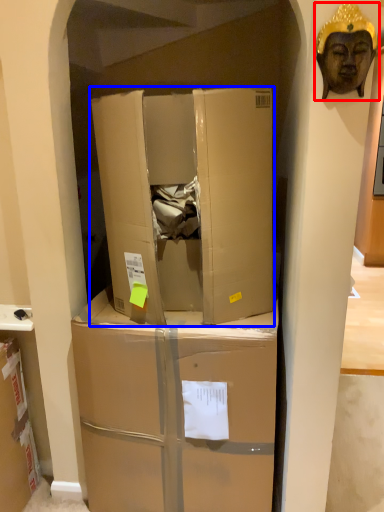
Question: Which object is closer to the camera taking this photo, person (highlighted by a red box) or box (highlighted by a blue box)?

Choices:
 (A) person
 (B) box

Answer: (A)